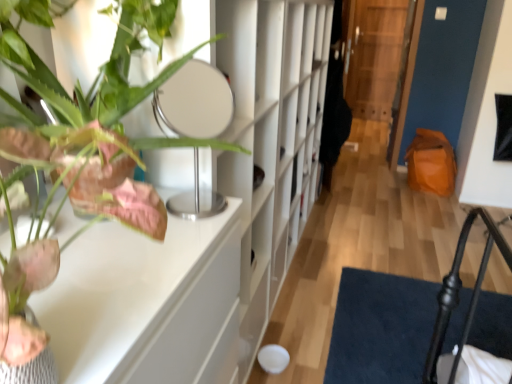
Find the location of a particular element. This screenshot has width=512, height=384. free spot below green matte plant at upper left (from a real-world perspective) is located at coordinates (135, 252).